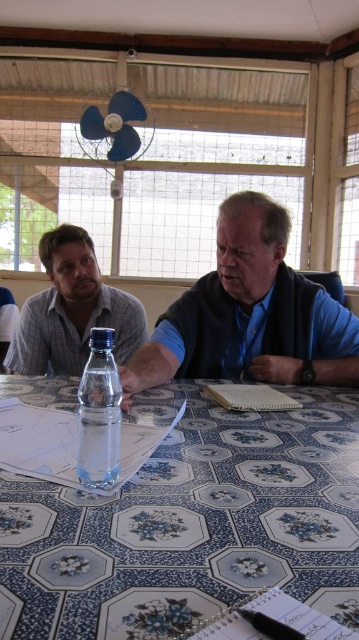
Question: Which object is farther from the camera taking this photo?

Choices:
 (A) matte gray shirt at left
 (B) clear glass water at table center
 (C) blue fabric vest at center

Answer: (A)

Question: Is clear plastic bottle at center behind clear glass water at table center?

Choices:
 (A) yes
 (B) no

Answer: (B)

Question: Does blue fabric vest at center have a smaller size compared to blue matte fan at upper center?

Choices:
 (A) no
 (B) yes

Answer: (A)

Question: Which object appears farthest from the camera in this image?

Choices:
 (A) matte gray shirt at left
 (B) clear glass water at table center

Answer: (A)

Question: Based on their relative distances, which object is farther from the blue floral tablecloth at center?

Choices:
 (A) clear plastic bottle at center
 (B) blue matte fan at upper center
 (C) matte gray shirt at left
 (D) clear glass water at table center

Answer: (B)

Question: Is blue fabric vest at center bigger than matte gray shirt at left?

Choices:
 (A) yes
 (B) no

Answer: (A)